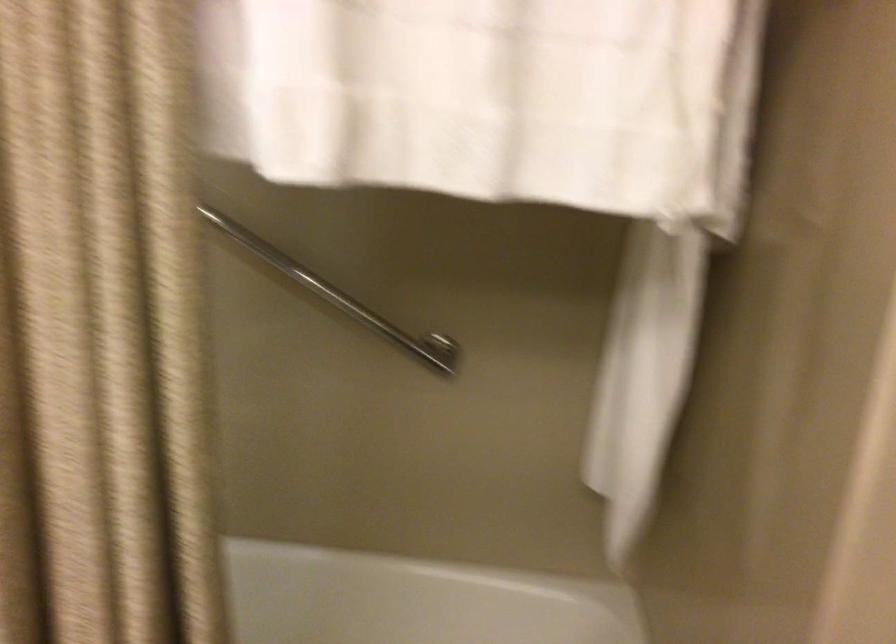
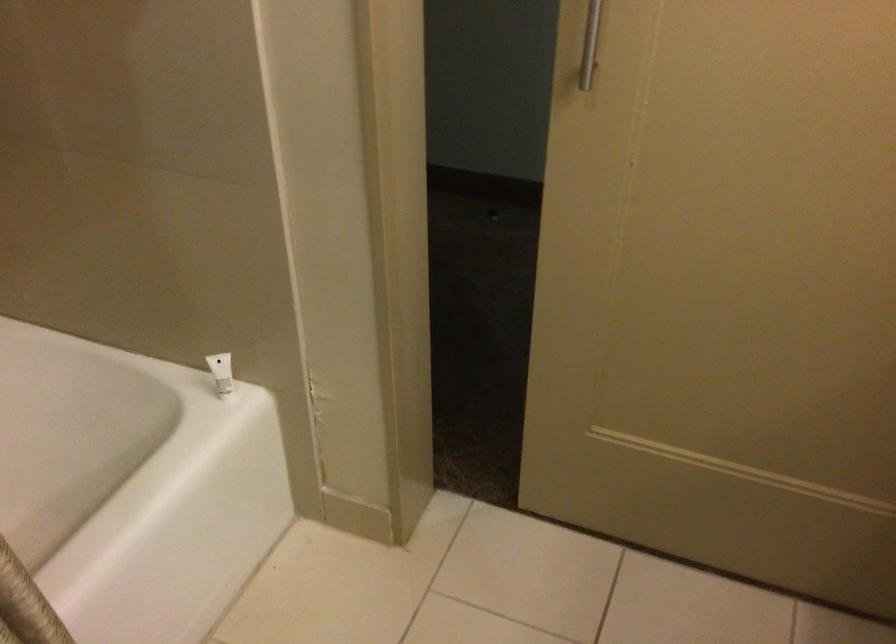
First-person continuous shooting, in which direction is the camera rotating?

The camera's rotation is toward right-down.